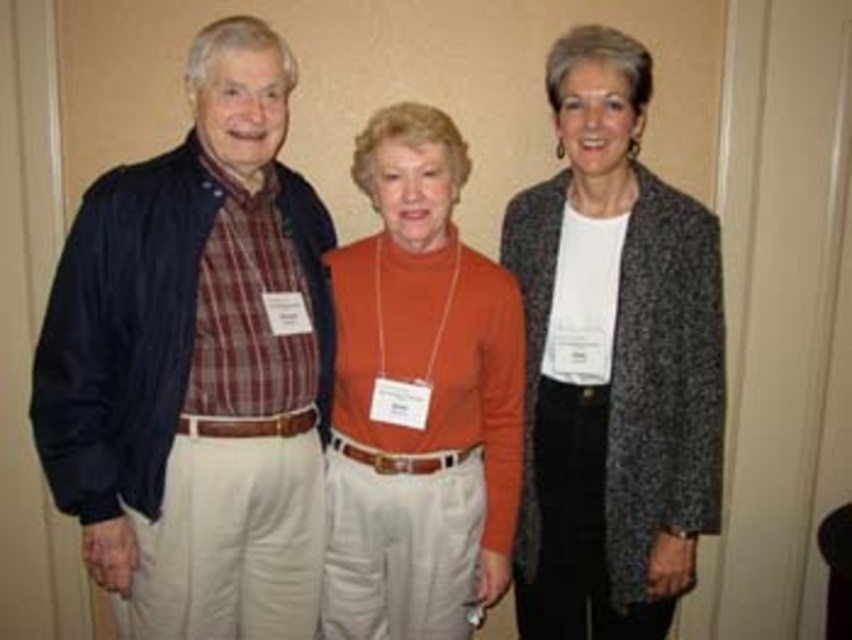
Question: Is matte black jacket at left closer to camera compared to orange turtleneck sweater at center?

Choices:
 (A) no
 (B) yes

Answer: (B)

Question: Which of the following is the closest to the observer?

Choices:
 (A) (459, 525)
 (B) (154, 195)
 (C) (544, 481)

Answer: (B)

Question: Which object is closer to the camera taking this photo?

Choices:
 (A) orange turtleneck sweater at center
 (B) speckled woolen cardigan at center
 (C) matte black jacket at left

Answer: (C)

Question: Does speckled woolen cardigan at center have a smaller size compared to orange turtleneck sweater at center?

Choices:
 (A) no
 (B) yes

Answer: (A)

Question: Which object is farther from the camera taking this photo?

Choices:
 (A) orange turtleneck sweater at center
 (B) speckled woolen cardigan at center

Answer: (B)

Question: Is speckled woolen cardigan at center bigger than orange turtleneck sweater at center?

Choices:
 (A) no
 (B) yes

Answer: (B)